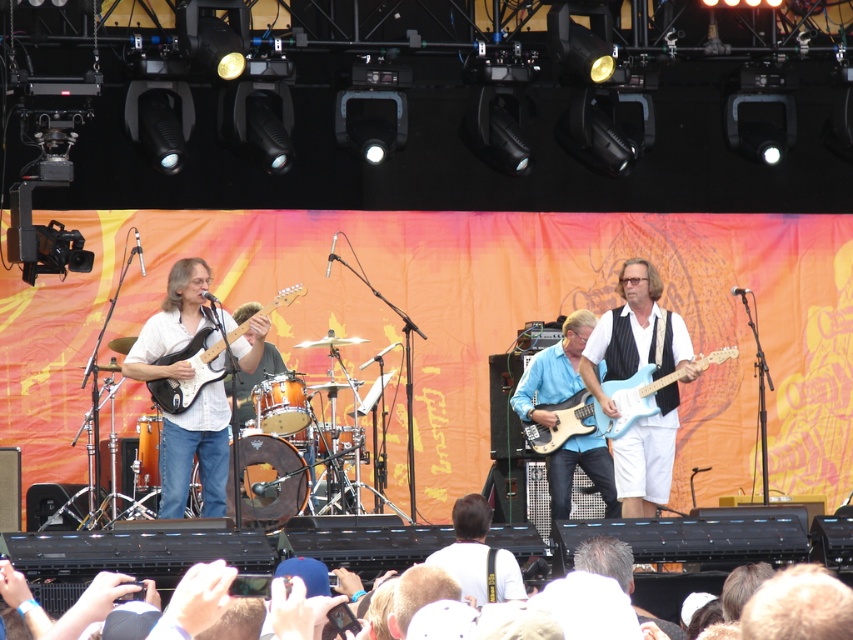
Question: Which point is closer to the camera taking this photo?

Choices:
 (A) (642, 420)
 (B) (558, 372)
 (C) (177, 362)

Answer: (C)

Question: Is matte white guitar at left smaller than white fabric shirt at center?

Choices:
 (A) yes
 (B) no

Answer: (B)

Question: Is matte white guitar at left above matte black electric guitar at left?

Choices:
 (A) yes
 (B) no

Answer: (A)

Question: Which of the following is the closest to the observer?

Choices:
 (A) white fabric shirt at center
 (B) matte black electric guitar at left
 (C) light blue glossy electric guitar at center
 (D) blue glossy guitar at center

Answer: (A)

Question: Which of the following is the farthest from the observer?

Choices:
 (A) matte white guitar at center
 (B) white fabric shirt at center
 (C) matte white guitar at left
 (D) matte black electric guitar at left

Answer: (A)

Question: Is blue glossy electric guitar at center wider than white fabric shirt at center?

Choices:
 (A) yes
 (B) no

Answer: (A)